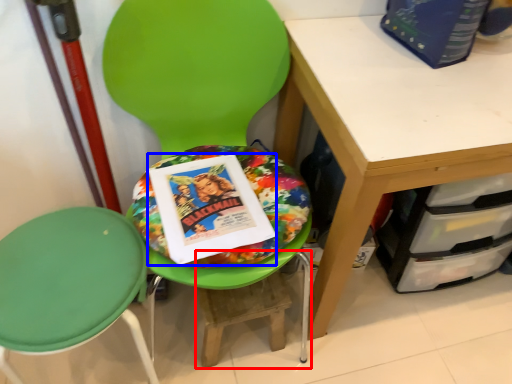
Question: Which object is further to the camera taking this photo, step stool (highlighted by a red box) or paperback book (highlighted by a blue box)?

Choices:
 (A) step stool
 (B) paperback book

Answer: (A)